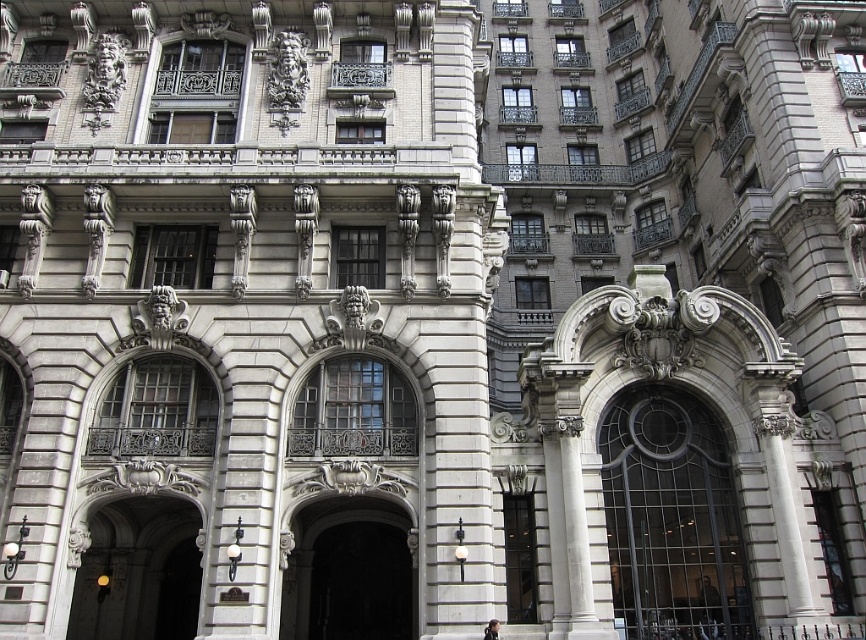
You are standing in front of the grand building and want to take a photo. You notice two points marked on the building facade at coordinates point (703, 426) and point (309, 563). Which point is closer to your camera when taking the photo?

Point (703, 426) is closer to the camera than point (309, 563).

You are an architect visiting the building and need to enter through the black glass door at center. However, you have a large sculpture that is 3 meters wide. Can the sculpture pass through the dark gray stone archway at center?

The black glass door at center is smaller than the dark gray stone archway at center, so the sculpture can pass through the dark gray stone archway at center since it is larger than the door.